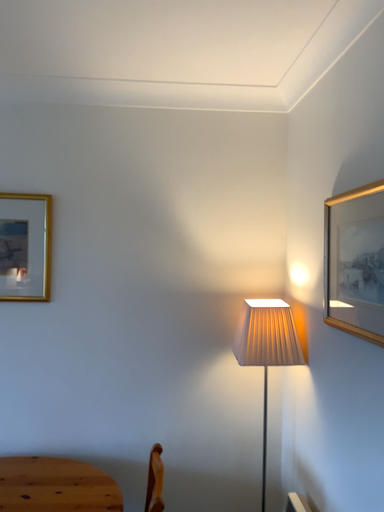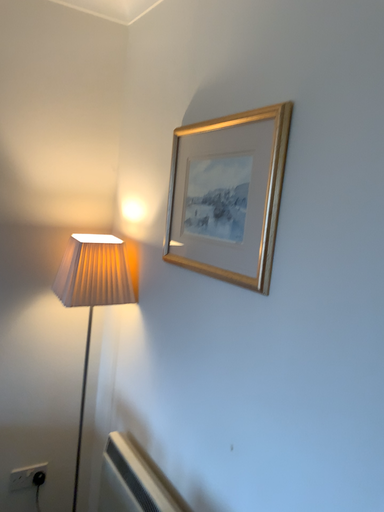
Question: How did the camera likely rotate when shooting the video?

Choices:
 (A) rotated right
 (B) rotated left

Answer: (A)